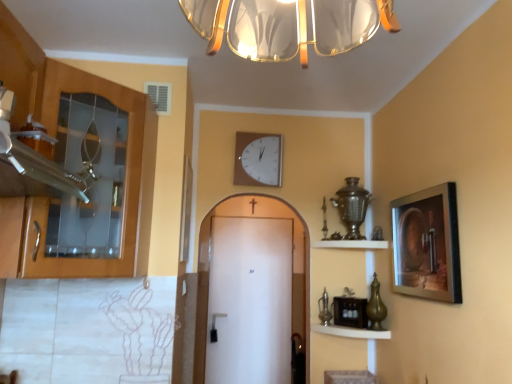
Question: From the image's perspective, is white matte door at center located above metallic gold shelf at upper center, which is the first shelf from top to bottom?

Choices:
 (A) no
 (B) yes

Answer: (A)

Question: Could metallic gold shelf at upper center, which is the first shelf from top to bottom, be considered to be inside white matte door at center?

Choices:
 (A) yes
 (B) no

Answer: (B)

Question: From a real-world perspective, is white matte door at center beneath metallic gold shelf at upper center, which is the first shelf from top to bottom?

Choices:
 (A) no
 (B) yes

Answer: (B)

Question: Is white matte door at center at the right side of metallic gold shelf at upper center, which is the first shelf from top to bottom?

Choices:
 (A) yes
 (B) no

Answer: (B)

Question: Can you confirm if white matte door at center is taller than metallic gold shelf at upper center, which is the first shelf from top to bottom?

Choices:
 (A) yes
 (B) no

Answer: (A)

Question: Looking at their shapes, would you say white matte door at center is wider or thinner than wooden shelf at lower center, the 1th shelf from the bottom?

Choices:
 (A) thin
 (B) wide

Answer: (A)

Question: Is white matte door at center spatially inside wooden shelf at lower center, the 1th shelf from the bottom, or outside of it?

Choices:
 (A) inside
 (B) outside

Answer: (B)

Question: From the image's perspective, is white matte door at center positioned above or below wooden shelf at lower center, which is the 2th shelf in top-to-bottom order?

Choices:
 (A) below
 (B) above

Answer: (A)

Question: From a real-world perspective, is white matte door at center positioned above or below wooden shelf at lower center, which is the 2th shelf in top-to-bottom order?

Choices:
 (A) above
 (B) below

Answer: (B)

Question: From a real-world perspective, is wooden shelf at lower center, the 1th shelf from the bottom, physically located above or below wooden cabinet at left?

Choices:
 (A) below
 (B) above

Answer: (A)

Question: Is wooden shelf at lower center, which is the 2th shelf in top-to-bottom order, wider or thinner than wooden cabinet at left?

Choices:
 (A) wide
 (B) thin

Answer: (B)

Question: In the image, is wooden shelf at lower center, the 1th shelf from the bottom, on the left side or the right side of wooden cabinet at left?

Choices:
 (A) left
 (B) right

Answer: (B)

Question: In terms of height, does wooden shelf at lower center, which is the 2th shelf in top-to-bottom order, look taller or shorter compared to wooden cabinet at left?

Choices:
 (A) short
 (B) tall

Answer: (A)

Question: Is metallic gold shelf at upper center, which is the first shelf from top to bottom, in front of or behind wooden cabinet at left in the image?

Choices:
 (A) behind
 (B) front

Answer: (A)

Question: From the image's perspective, relative to wooden cabinet at left, is metallic gold shelf at upper center, the 2th shelf when ordered from bottom to top, above or below?

Choices:
 (A) below
 (B) above

Answer: (A)